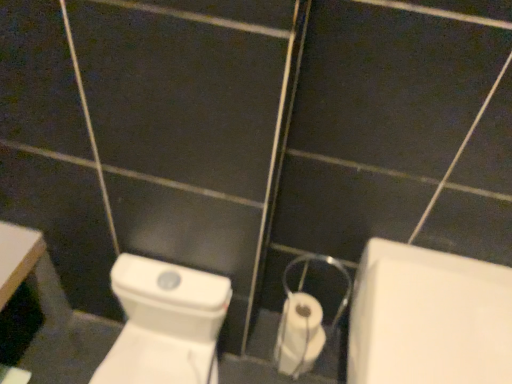
Question: Is white plastic toilet paper at center taller or shorter than white glossy bath at lower right?

Choices:
 (A) short
 (B) tall

Answer: (A)

Question: Based on their positions, is white plastic toilet paper at center located to the left or right of white glossy bath at lower right?

Choices:
 (A) left
 (B) right

Answer: (A)

Question: Which is farther from the white plastic toilet paper at center?

Choices:
 (A) white glossy toilet at center
 (B) white glossy bath at lower right

Answer: (A)

Question: Considering the real-world distances, which object is closest to the white glossy bath at lower right?

Choices:
 (A) white plastic toilet paper at center
 (B) white glossy toilet at center

Answer: (A)